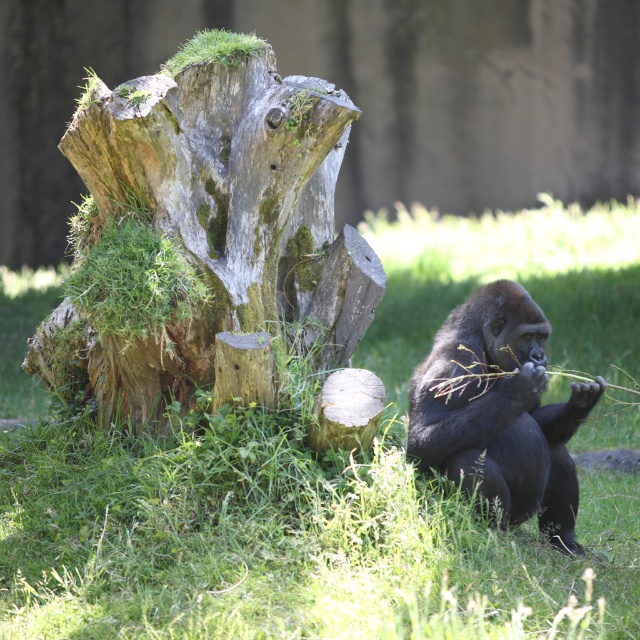
You are a wildlife photographer aiming to capture a closeup of the weathered wood stump at center. You are currently standing near the black fur ape at lower right. Can you move directly towards the stump without needing to go around any obstacles?

The weathered wood stump at center is closer to the viewer than the black fur ape at lower right, so yes, you can move directly towards the stump without needing to go around any obstacles because the stump is in front of the ape.

You are a hiker who wants to sit down and rest. You see the green grass at center and the weathered wood stump at center. Which one is a better option to sit on?

The weathered wood stump at center is a better option to sit on because the green grass at center is located below it, which might be uneven or less stable compared to the stump.